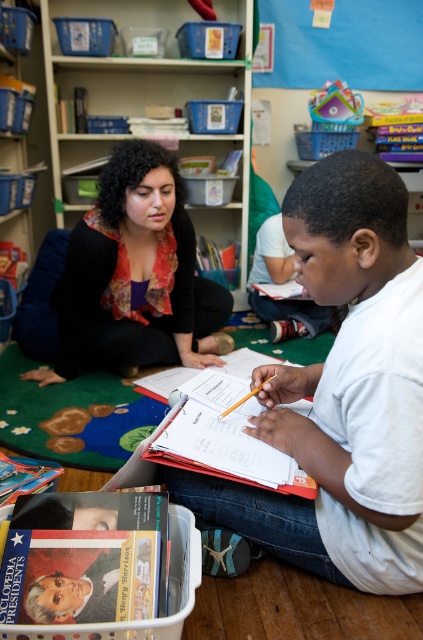
You are a teacher observing a student in the classroom. The student is sitting on the floor and has both the white paper at center and the white matte shirt at lower right in their vicinity. Which object is taller?

The white matte shirt at lower right is taller than the white paper at center.

You are a teacher observing a student in the classroom. The student is sitting on the floor with a hardcover book at lower left and a white matte shirt at lower right. Which object is closer to you, the observer?

The hardcover book at lower left is closer to you because it is in front of the white matte shirt at lower right.

You are a student sitting on the floor in the classroom. You notice two points marked on the notebook in front of you. The first point is at coordinates point(194, 392) and the second is at point(307, 320). Which point is closer to you?

The point at coordinates point(194, 392) is closer to you than the point at point(307, 320) because it is nearer to the camera.